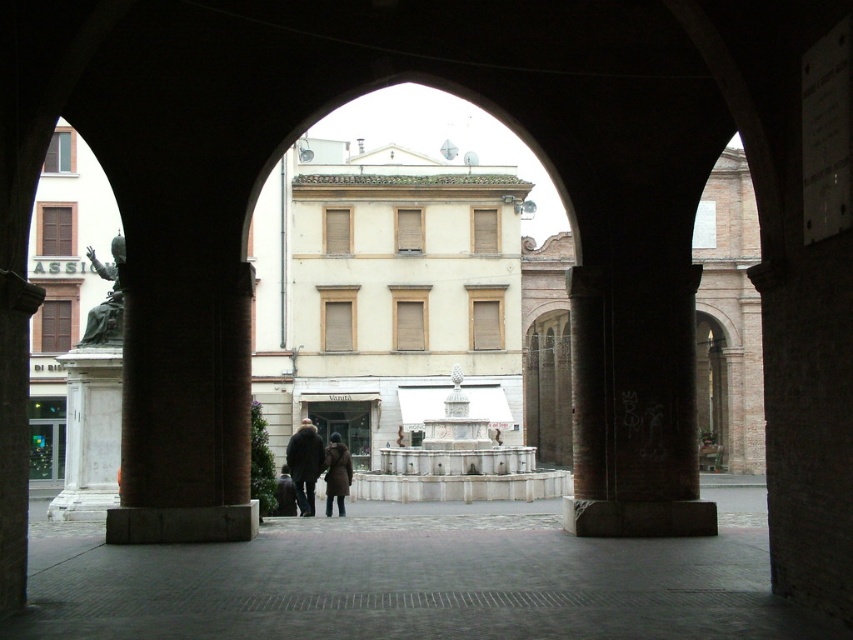
Question: Does bronze statue at left have a larger size compared to black wool coat at center?

Choices:
 (A) yes
 (B) no

Answer: (B)

Question: Which of the following is the farthest from the observer?

Choices:
 (A) brown fuzzy coat at center
 (B) bronze statue at left

Answer: (A)

Question: Is black wool coat at center positioned before brown fuzzy coat at center?

Choices:
 (A) no
 (B) yes

Answer: (B)

Question: Which object is positioned closest to the black wool coat at center?

Choices:
 (A) brown leather coat at center
 (B) brown fuzzy coat at center

Answer: (B)

Question: Does black wool coat at center appear over brown leather coat at center?

Choices:
 (A) no
 (B) yes

Answer: (A)

Question: Which object appears closest to the camera in this image?

Choices:
 (A) black wool coat at center
 (B) bronze statue at left
 (C) brown leather coat at center
 (D) brown fuzzy coat at center

Answer: (B)